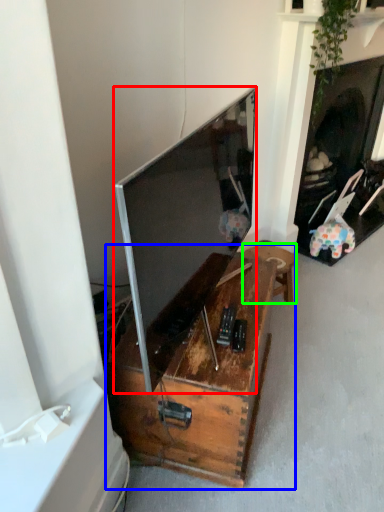
Question: Considering the real-world distances, which object is closest to television (highlighted by a red box)? table (highlighted by a blue box) or furniture (highlighted by a green box).

Choices:
 (A) table
 (B) furniture

Answer: (A)